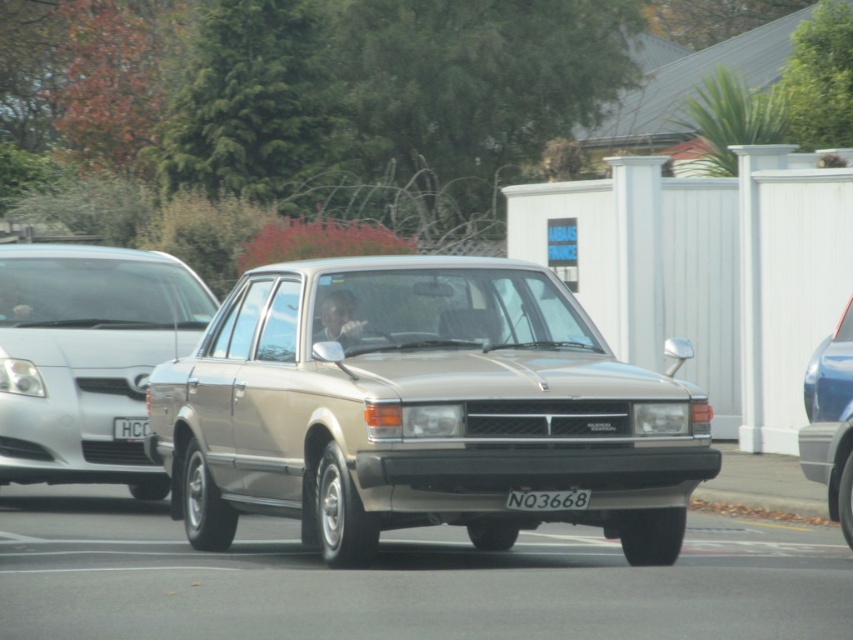
You are a delivery person trying to park your vehicle in a narrow alley. You see the satin silver sedan at left and the white plastic license plate at center in the image. Which vehicle should you avoid hitting to prevent damage to your car?

The satin silver sedan at left is much taller than the white plastic license plate at center, so you should avoid hitting the satin silver sedan at left to prevent damage to your car.

You are a pedestrian standing at the center of the street. You see two points marked in the image. Which point is closer to you? The points are point 1 at coordinates point (548, 513) and point 2 at coordinates point (573, 504).

Point 2 at coordinates point (573, 504) is closer to you because it is in front of point 1 at coordinates point (548, 513).

You are a delivery driver who needs to park your car in a parking lot. You see a satin silver sedan at left in the image. Where should you park your car to avoid blocking the entrance?

The satin silver sedan at left is positioned at point (86, 356), so you should park your car away from that location to avoid blocking the entrance.